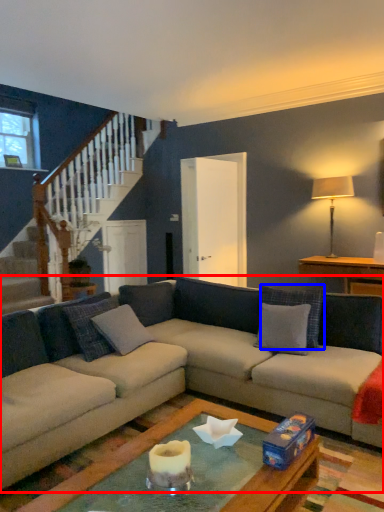
Question: Which object appears farthest to the camera in this image, studio couch (highlighted by a red box) or pillow (highlighted by a blue box)?

Choices:
 (A) studio couch
 (B) pillow

Answer: (B)